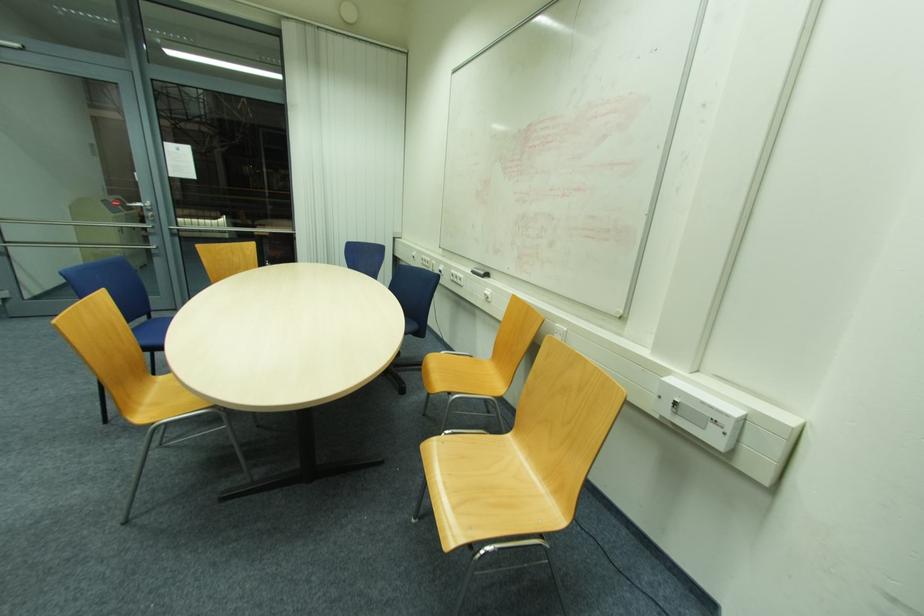
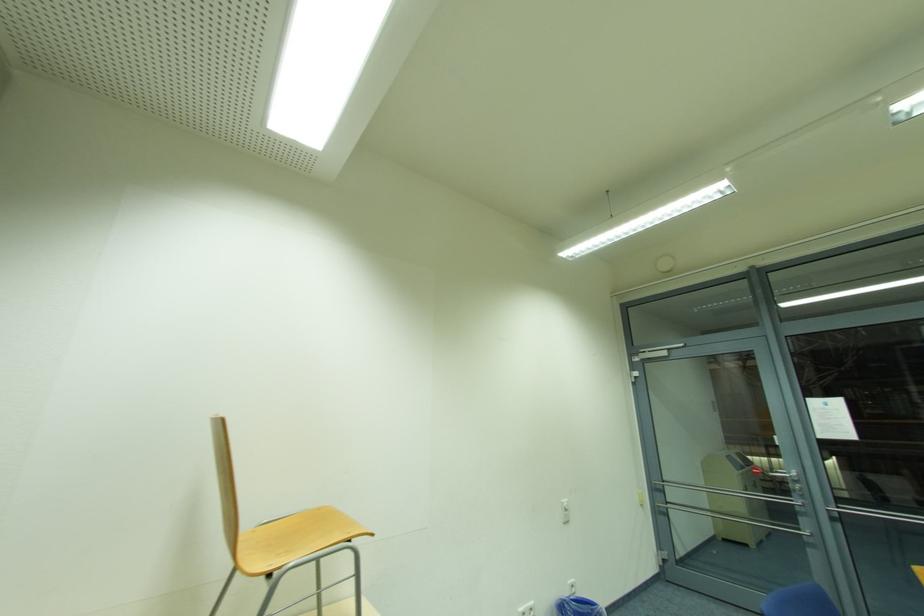
How did the camera likely rotate?

The camera rotated toward left-up.